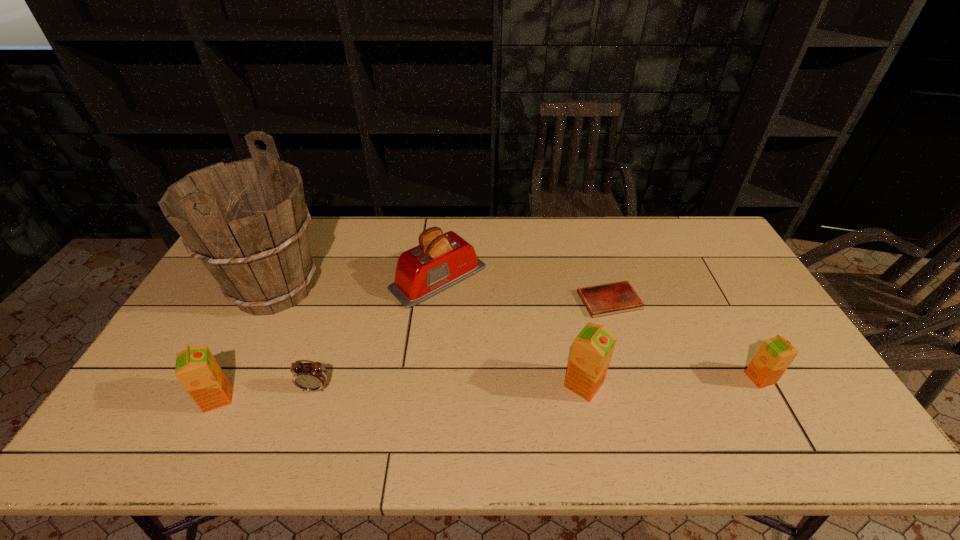
Please point a space for a new orange_juice to maintain equal intervals. Please provide its 2D coordinates. Your answer should be formatted as a tuple, i.e. [(x, y)], where the tuple contains the x and y coordinates of a point satisfying the conditions above.

[(403, 392)]